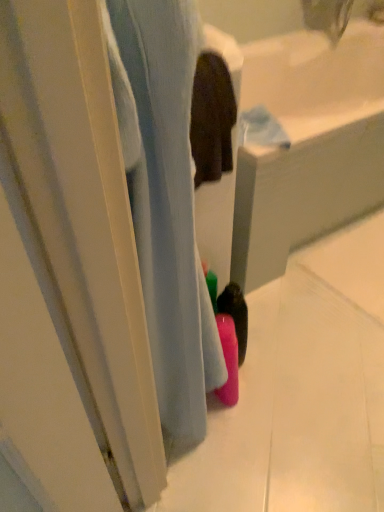
Question: In which direction should I rotate to look at pink matte bottle at lower center, arranged as the 1th bath when viewed from the front?

Choices:
 (A) left
 (B) right

Answer: (A)

Question: Is pink matte bottle at center, the 1th bath viewed from the back, far from pink matte bottle at lower center, which is the 2th bath in back-to-front order?

Choices:
 (A) yes
 (B) no

Answer: (B)

Question: Does pink matte bottle at center, the second bath viewed from the front, appear on the left side of pink matte bottle at lower center, which is the 2th bath in back-to-front order?

Choices:
 (A) no
 (B) yes

Answer: (A)

Question: Can you confirm if pink matte bottle at center, the 1th bath viewed from the back, is taller than pink matte bottle at lower center, which is the 2th bath in back-to-front order?

Choices:
 (A) no
 (B) yes

Answer: (A)

Question: Is pink matte bottle at center, the second bath viewed from the front, shorter than pink matte bottle at lower center, which is the 2th bath in back-to-front order?

Choices:
 (A) no
 (B) yes

Answer: (B)

Question: Is pink matte bottle at center, the 1th bath viewed from the back, looking in the opposite direction of pink matte bottle at lower center, arranged as the 1th bath when viewed from the front?

Choices:
 (A) no
 (B) yes

Answer: (A)

Question: From the image's perspective, is pink matte bottle at center, the 1th bath viewed from the back, above pink matte bottle at lower center, which is the 2th bath in back-to-front order?

Choices:
 (A) no
 (B) yes

Answer: (B)

Question: From a real-world perspective, is pink matte bottle at lower center, arranged as the 1th bath when viewed from the front, under pink matte bottle at center, the second bath viewed from the front?

Choices:
 (A) no
 (B) yes

Answer: (A)

Question: Is pink matte bottle at lower center, arranged as the 1th bath when viewed from the front, in front of pink matte bottle at center, the second bath viewed from the front?

Choices:
 (A) yes
 (B) no

Answer: (A)

Question: Is pink matte bottle at lower center, arranged as the 1th bath when viewed from the front, facing away from pink matte bottle at center, the 1th bath viewed from the back?

Choices:
 (A) yes
 (B) no

Answer: (B)

Question: Considering the relative positions of pink matte bottle at lower center, arranged as the 1th bath when viewed from the front, and pink matte bottle at center, the second bath viewed from the front, in the image provided, is pink matte bottle at lower center, arranged as the 1th bath when viewed from the front, to the left of pink matte bottle at center, the second bath viewed from the front, from the viewer's perspective?

Choices:
 (A) yes
 (B) no

Answer: (A)

Question: Is pink matte bottle at lower center, arranged as the 1th bath when viewed from the front, taller than pink matte bottle at center, the 1th bath viewed from the back?

Choices:
 (A) yes
 (B) no

Answer: (A)

Question: From the image's perspective, does pink matte bottle at lower center, arranged as the 1th bath when viewed from the front, appear higher than pink matte bottle at center, the second bath viewed from the front?

Choices:
 (A) no
 (B) yes

Answer: (A)

Question: Visually, is pink matte bottle at center, the second bath viewed from the front, positioned to the left or to the right of pink matte bottle at lower center, which is the 2th bath in back-to-front order?

Choices:
 (A) left
 (B) right

Answer: (B)